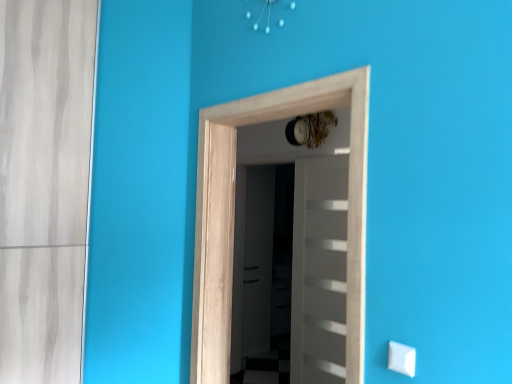
Question: Considering the positions of white glossy door at center, acting as the second door starting from the front, and natural wood door at center, which ranks as the first door in front-to-back order, in the image, is white glossy door at center, acting as the second door starting from the front, wider or thinner than natural wood door at center, which ranks as the first door in front-to-back order,?

Choices:
 (A) thin
 (B) wide

Answer: (A)

Question: Considering the positions of point (342, 216) and point (205, 279), is point (342, 216) closer or farther from the camera than point (205, 279)?

Choices:
 (A) farther
 (B) closer

Answer: (A)

Question: Which object is positioned farthest from the transparent glass screen door at center?

Choices:
 (A) white glossy door at center, acting as the second door starting from the front
 (B) white plastic light switch at lower right
 (C) natural wood door at center, which ranks as the first door in front-to-back order

Answer: (B)

Question: Estimate the real-world distances between objects in this image. Which object is closer to the transparent glass screen door at center?

Choices:
 (A) natural wood door at center, the 2th door when ordered from back to front
 (B) white glossy door at center, acting as the second door starting from the front
 (C) white plastic light switch at lower right

Answer: (B)